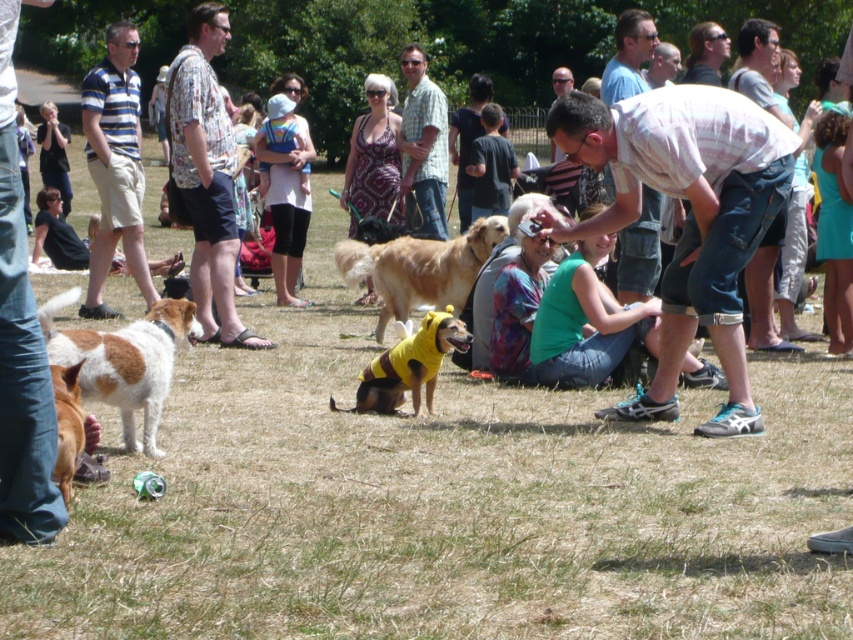
Which is in front, point (67, 433) or point (502, 122)?

Point (67, 433)

Does brown fur dog at lower left lie in front of light brown shirt at center?

That is True.

Does point (55, 381) lie in front of point (457, 108)?

Yes, it is.

Where is `brown fur dog at lower left`? The image size is (853, 640). brown fur dog at lower left is located at coordinates (67, 426).

What do you see at coordinates (67, 426) in the screenshot? This screenshot has height=640, width=853. I see `brown fur dog at lower left` at bounding box center [67, 426].

Which is below, brown fur dog at lower left or matte white shirt at center?

brown fur dog at lower left is below.

The image size is (853, 640). I want to click on brown fur dog at lower left, so click(67, 426).

Does striped polo shirt at left have a lesser width compared to matte white shirt at center?

Correct, striped polo shirt at left's width is less than matte white shirt at center's.

Which is more to the right, striped polo shirt at left or matte white shirt at center?

From the viewer's perspective, matte white shirt at center appears more on the right side.

Describe the element at coordinates (115, 164) in the screenshot. This screenshot has height=640, width=853. I see `striped polo shirt at left` at that location.

Find the location of a particular element. Image resolution: width=853 pixels, height=640 pixels. striped polo shirt at left is located at coordinates (115, 164).